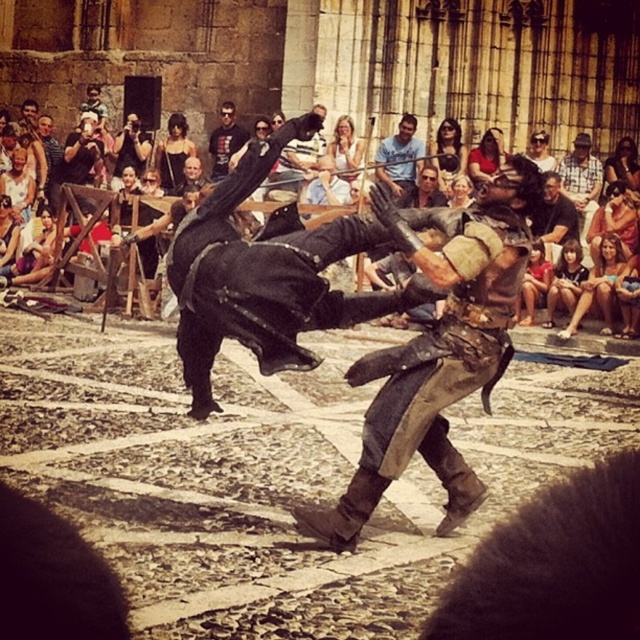
Can you confirm if black leather armor at center is taller than smooth skin face at center?

Yes.

Is point (282, 284) closer to camera compared to point (442, 168)?

That is True.

Locate an element on the screen. black leather armor at center is located at coordinates (262, 276).

Which is in front, point (168, 145) or point (225, 129)?

Point (225, 129) is in front.

Which of these two, black leather dress at center or dark brown leather jacket at center, stands taller?

With more height is dark brown leather jacket at center.

The height and width of the screenshot is (640, 640). What are the coordinates of `black leather dress at center` in the screenshot? It's located at (173, 154).

Image resolution: width=640 pixels, height=640 pixels. What are the coordinates of `black leather dress at center` in the screenshot? It's located at (173, 154).

Who is more distant from viewer, (560, 236) or (566, 285)?

Positioned behind is point (560, 236).

Can you confirm if brown leather jacket at center is positioned above smooth skin face at lower right?

Yes, brown leather jacket at center is above smooth skin face at lower right.

Looking at this image, measure the distance between brown leather jacket at center and camera.

brown leather jacket at center is 35.30 meters from camera.

The height and width of the screenshot is (640, 640). What are the coordinates of `brown leather jacket at center` in the screenshot? It's located at [x=554, y=218].